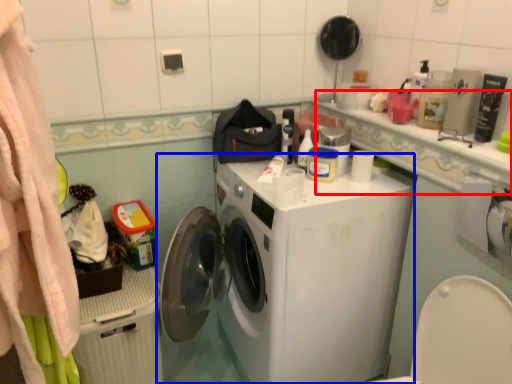
Question: Among these objects, which one is farthest to the camera, counter top (highlighted by a red box) or washing machine (highlighted by a blue box)?

Choices:
 (A) counter top
 (B) washing machine

Answer: (B)